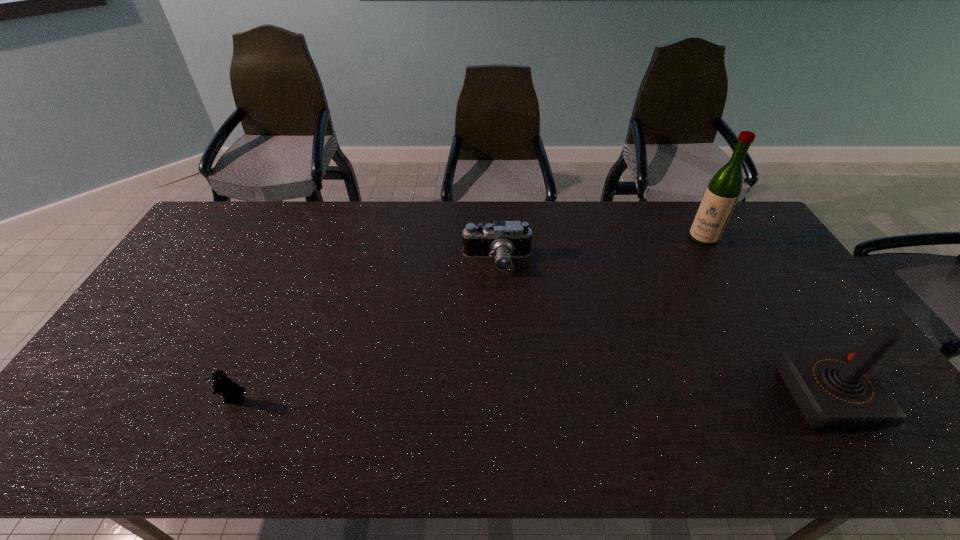
Locate an element on the screen. This screenshot has height=540, width=960. free space on the desktop that is between the Lego and the second tallest object and is positioned on the label of the farthest object is located at coordinates (587, 399).

The height and width of the screenshot is (540, 960). Find the location of `free spot on the desktop that is between the leftmost object and the second tallest object and is positioned at the lens of the camera`. free spot on the desktop that is between the leftmost object and the second tallest object and is positioned at the lens of the camera is located at coordinates (475, 399).